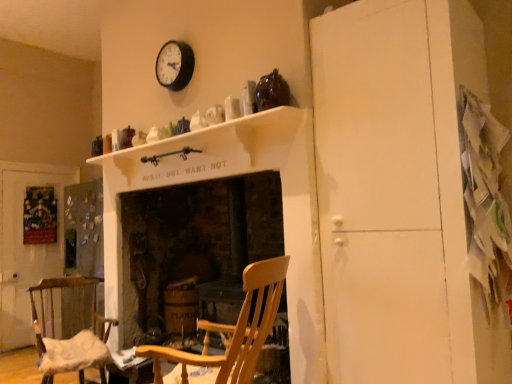
Question: Does point (283, 112) appear closer or farther from the camera than point (352, 31)?

Choices:
 (A) closer
 (B) farther

Answer: (B)

Question: From a real-world perspective, is white matte mantle at upper center above or below white matte cabinet at right?

Choices:
 (A) above
 (B) below

Answer: (A)

Question: Which of these objects is positioned closest to the wooden rocking chair at center, which is the second chair from back to front?

Choices:
 (A) white matte mantle at upper center
 (B) wooden chair with fabric cushion at lower left, marked as the second chair in a front-to-back arrangement
 (C) wooden fireplace at center
 (D) white paper at lower left
 (E) matte black clock at upper center

Answer: (D)

Question: Considering the real-world distances, which object is farthest from the white matte mantle at upper center?

Choices:
 (A) white paper at lower left
 (B) wooden fireplace at center
 (C) wooden chair with fabric cushion at lower left, marked as the first chair in a back-to-front arrangement
 (D) wooden rocking chair at center, which is the second chair from back to front
 (E) matte black clock at upper center

Answer: (A)